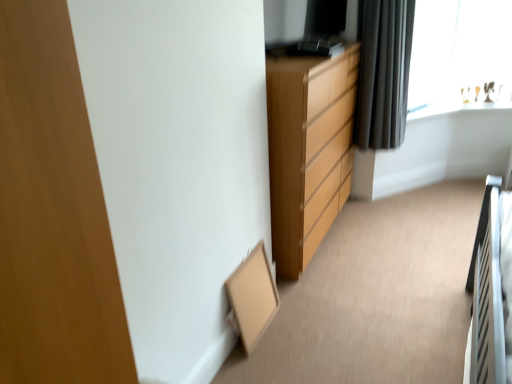
Question: Is transparent glass window at upper right oriented towards matte wood chest of drawers at center?

Choices:
 (A) yes
 (B) no

Answer: (B)

Question: From a real-world perspective, is transparent glass window at upper right physically above matte wood chest of drawers at center?

Choices:
 (A) yes
 (B) no

Answer: (A)

Question: Is matte wood chest of drawers at center inside transparent glass window at upper right?

Choices:
 (A) no
 (B) yes

Answer: (A)

Question: Considering the relative positions of transparent glass window at upper right and matte wood chest of drawers at center in the image provided, is transparent glass window at upper right to the left of matte wood chest of drawers at center from the viewer's perspective?

Choices:
 (A) yes
 (B) no

Answer: (B)

Question: From the image's perspective, is transparent glass window at upper right under matte wood chest of drawers at center?

Choices:
 (A) yes
 (B) no

Answer: (B)

Question: In the image, is matte wood chest of drawers at center on the left side or the right side of transparent glass window at upper right?

Choices:
 (A) right
 (B) left

Answer: (B)

Question: Considering the positions of matte wood chest of drawers at center and transparent glass window at upper right in the image, is matte wood chest of drawers at center bigger or smaller than transparent glass window at upper right?

Choices:
 (A) big
 (B) small

Answer: (A)

Question: Is matte wood chest of drawers at center inside or outside of transparent glass window at upper right?

Choices:
 (A) inside
 (B) outside

Answer: (B)

Question: Is point (349, 173) positioned closer to the camera than point (474, 23)?

Choices:
 (A) closer
 (B) farther

Answer: (A)

Question: Considering the relative positions of black fabric curtain at upper right and matte wood chest of drawers at center in the image provided, is black fabric curtain at upper right to the left or to the right of matte wood chest of drawers at center?

Choices:
 (A) right
 (B) left

Answer: (A)

Question: From a real-world perspective, relative to matte wood chest of drawers at center, is black fabric curtain at upper right vertically above or below?

Choices:
 (A) below
 (B) above

Answer: (B)

Question: From their relative heights in the image, would you say black fabric curtain at upper right is taller or shorter than matte wood chest of drawers at center?

Choices:
 (A) short
 (B) tall

Answer: (A)

Question: Considering the positions of black fabric curtain at upper right and matte wood chest of drawers at center in the image, is black fabric curtain at upper right wider or thinner than matte wood chest of drawers at center?

Choices:
 (A) wide
 (B) thin

Answer: (B)

Question: Is point (404, 21) closer or farther from the camera than point (424, 82)?

Choices:
 (A) farther
 (B) closer

Answer: (B)

Question: From a real-world perspective, relative to transparent glass window at upper right, is black fabric curtain at upper right vertically above or below?

Choices:
 (A) above
 (B) below

Answer: (B)